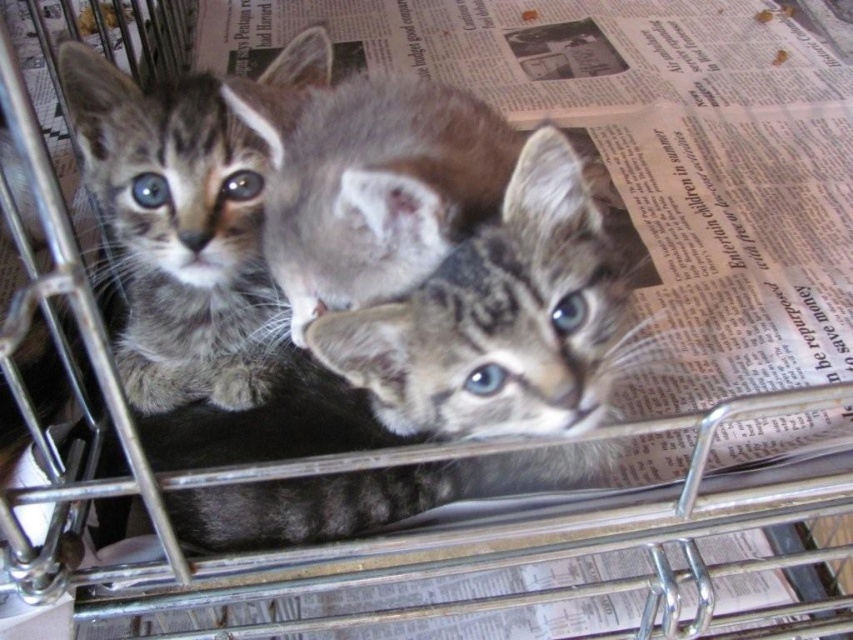
Does gray tabby kitten at left appear on the left side of gray fur kitten at center?

Yes, gray tabby kitten at left is to the left of gray fur kitten at center.

The image size is (853, 640). Describe the element at coordinates (178, 234) in the screenshot. I see `gray tabby kitten at left` at that location.

What do you see at coordinates (178, 234) in the screenshot? I see `gray tabby kitten at left` at bounding box center [178, 234].

Identify the location of gray tabby kitten at left. This screenshot has width=853, height=640. (178, 234).

Is gray tabby kitten at left wider than tabby fur kitten at center?

No, gray tabby kitten at left is not wider than tabby fur kitten at center.

What do you see at coordinates (178, 234) in the screenshot?
I see `gray tabby kitten at left` at bounding box center [178, 234].

Where is `gray tabby kitten at left`? The width and height of the screenshot is (853, 640). gray tabby kitten at left is located at coordinates (178, 234).

Does tabby fur kitten at center have a greater width compared to gray fur kitten at center?

Yes.

Is point (572, 433) less distant than point (405, 284)?

Yes, it is in front of point (405, 284).

The width and height of the screenshot is (853, 640). I want to click on tabby fur kitten at center, so click(x=498, y=317).